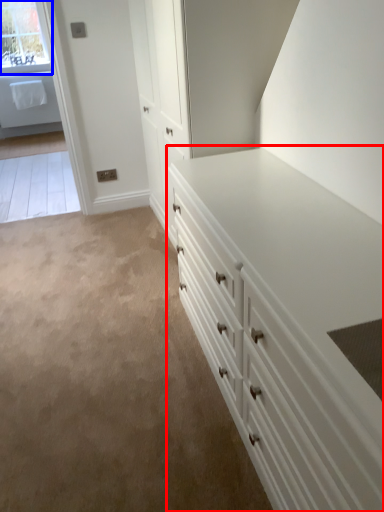
Question: Among these objects, which one is nearest to the camera, chest of drawers (highlighted by a red box) or window (highlighted by a blue box)?

Choices:
 (A) chest of drawers
 (B) window

Answer: (A)